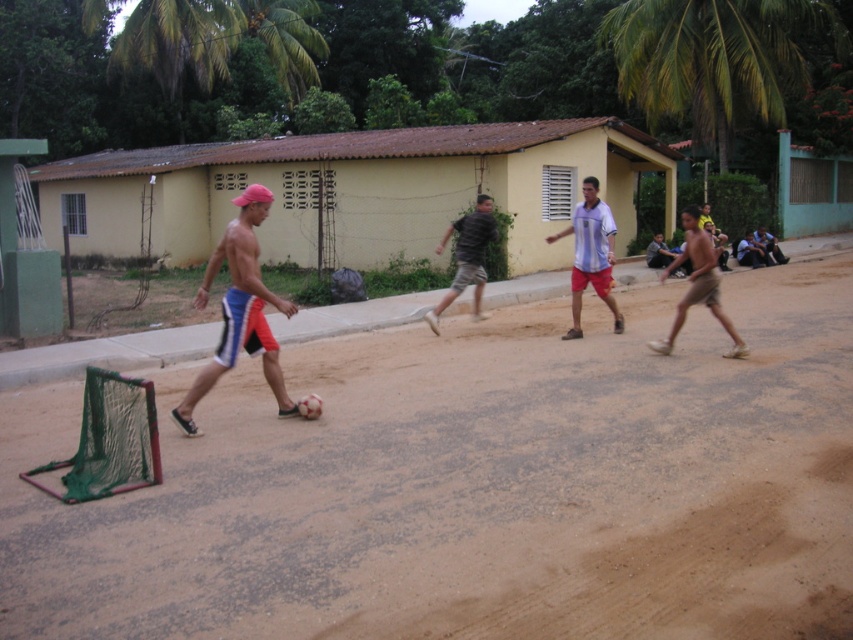
Is brown sandy ground at center further to the viewer compared to shiny blue shorts at center?

No, it is not.

Can you confirm if brown sandy ground at center is positioned to the left of shiny blue shorts at center?

No, brown sandy ground at center is not to the left of shiny blue shorts at center.

The width and height of the screenshot is (853, 640). I want to click on brown sandy ground at center, so click(x=476, y=486).

Who is lower down, shiny blue shorts at center or white striped shirt at center?

white striped shirt at center is lower down.

Which is above, shiny blue shorts at center or white striped shirt at center?

shiny blue shorts at center

Does point (244, 189) come in front of point (581, 205)?

No, (244, 189) is behind (581, 205).

You are a GUI agent. You are given a task and a screenshot of the screen. Output one action in this format:
    pyautogui.click(x=<x>, y=<y>)
    Task: Click on the shiny blue shorts at center
    This screenshot has width=853, height=640.
    Given the screenshot: What is the action you would take?
    pyautogui.click(x=239, y=308)

Which is in front, point (57, 221) or point (192, 385)?

Point (192, 385) is in front.

Between yellow matte building at center and shiny blue shorts at center, which one has more height?

yellow matte building at center

Where is `yellow matte building at center`? yellow matte building at center is located at coordinates (354, 189).